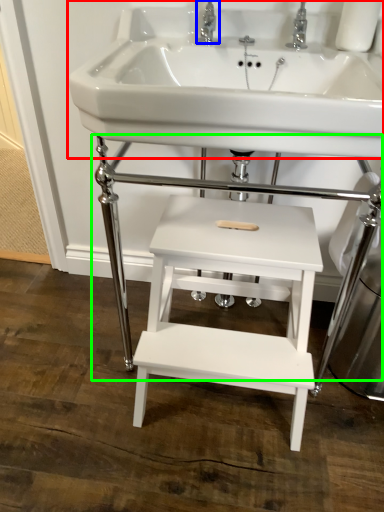
Question: Which is farther away from sink (highlighted by a red box)? tap (highlighted by a blue box) or table (highlighted by a green box)?

Choices:
 (A) tap
 (B) table

Answer: (B)